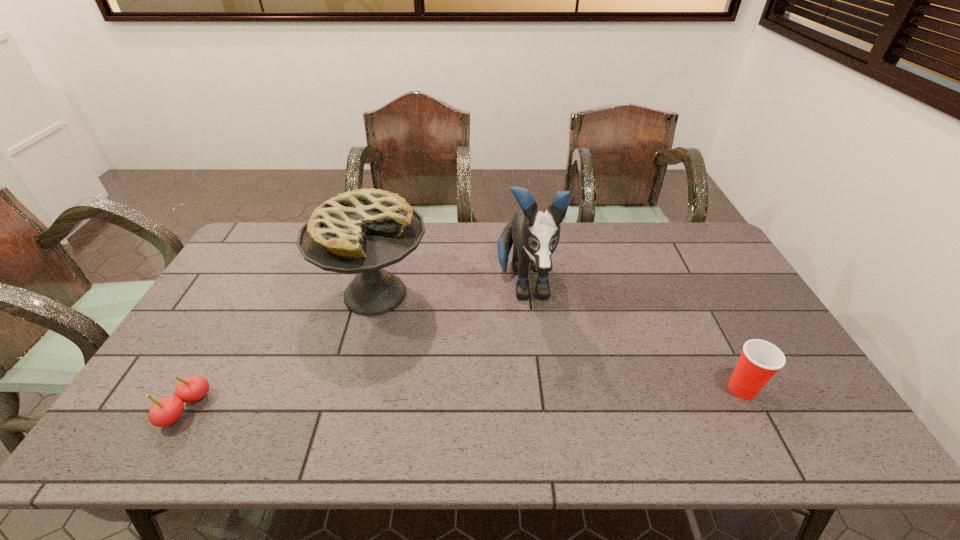
Locate an element on the screen. vacant space located 0.110m on the cut side of the third shortest object is located at coordinates (398, 362).

The width and height of the screenshot is (960, 540). I want to click on free region located on the cut side of the third shortest object, so pyautogui.click(x=413, y=404).

Identify the location of free space located on the cut side of the third shortest object. (x=393, y=346).

Find the location of a particular element. The height and width of the screenshot is (540, 960). vacant space located 0.120m on the front-facing side of the puppy is located at coordinates (535, 362).

Where is `vacant area located 0.200m on the front-facing side of the puppy`? The height and width of the screenshot is (540, 960). vacant area located 0.200m on the front-facing side of the puppy is located at coordinates (539, 388).

At what (x,y) coordinates should I click in order to perform the action: click on free location located 0.140m on the front-facing side of the puppy. Please return your answer as a coordinate pair (x, y). Looking at the image, I should click on (536, 369).

Where is `pie that is at the far edge`? The width and height of the screenshot is (960, 540). pie that is at the far edge is located at coordinates (362, 231).

Identify the location of puppy at the far edge. (535, 234).

What are the coordinates of `cherry present at the near edge` in the screenshot? It's located at (166, 411).

Where is `Dixie cup located at the near edge`? Dixie cup located at the near edge is located at coordinates (760, 360).